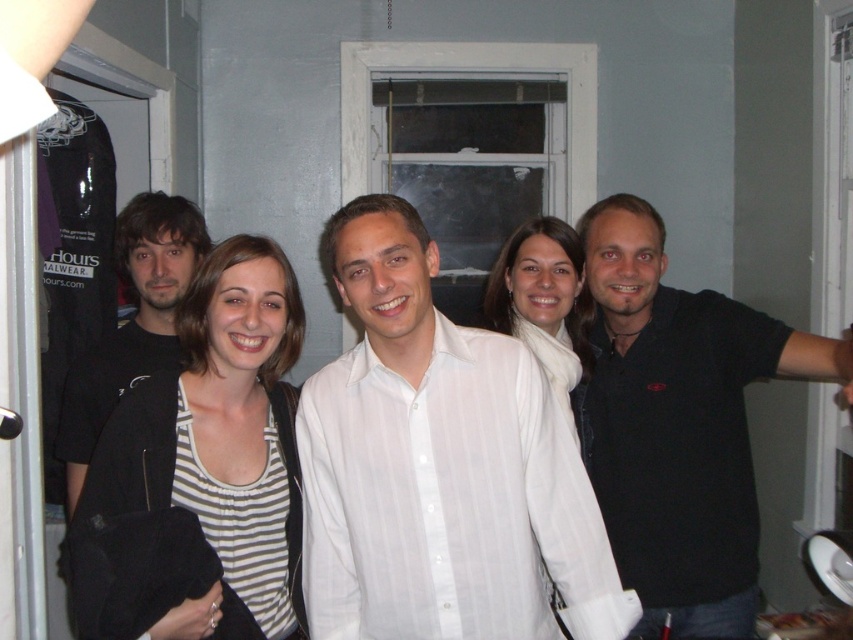
Question: Which point is farther to the camera?

Choices:
 (A) (682, 592)
 (B) (540, 260)

Answer: (B)

Question: Which of the following is the closest to the observer?

Choices:
 (A) white striped shirt at center
 (B) white sheer shirt at center
 (C) striped fabric shirt at center
 (D) black matte shirt at right

Answer: (D)

Question: Is striped fabric shirt at center positioned at the back of black matte jacket at left?

Choices:
 (A) yes
 (B) no

Answer: (B)

Question: Which of the following is the farthest from the observer?

Choices:
 (A) striped fabric shirt at center
 (B) white sheer shirt at center
 (C) black matte shirt at right
 (D) white striped shirt at center

Answer: (B)

Question: Is black matte shirt at right bigger than black matte jacket at left?

Choices:
 (A) no
 (B) yes

Answer: (B)

Question: Where is white striped shirt at center located in relation to white sheer shirt at center in the image?

Choices:
 (A) above
 (B) below

Answer: (B)